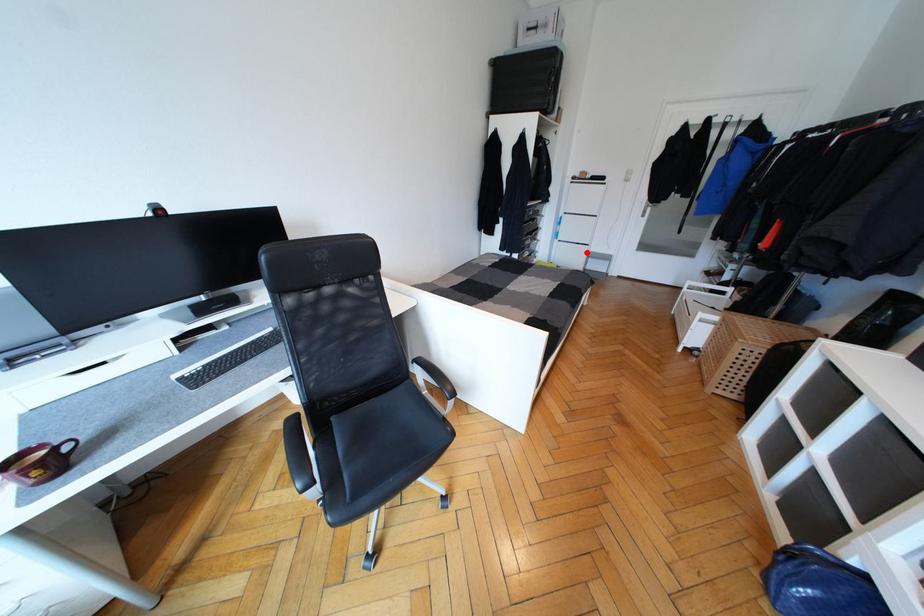
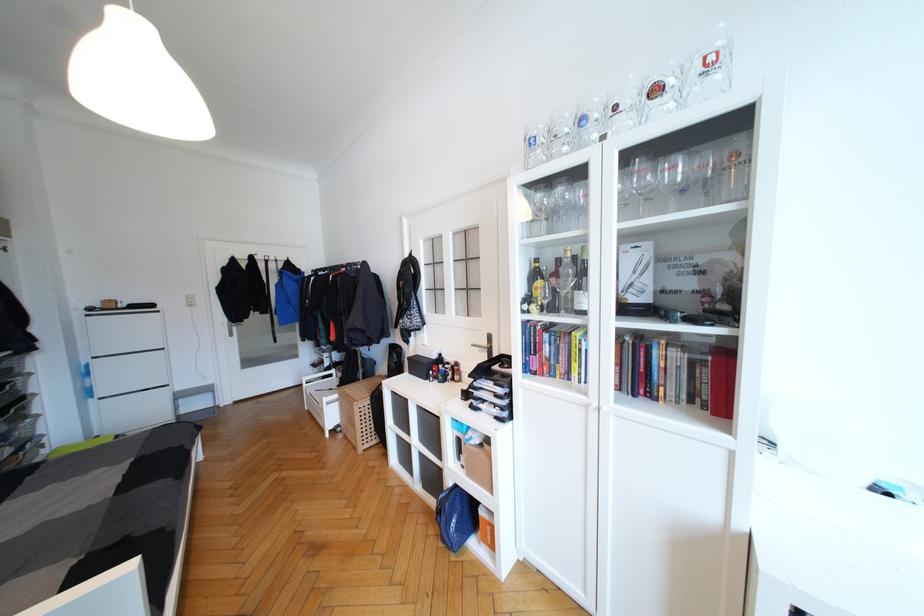
Question: I am providing you with two images of the same scene from different viewpoints. A red point is marked on the first image. Is the red point's position out of view in image 2?

Choices:
 (A) Yes
 (B) No

Answer: (B)